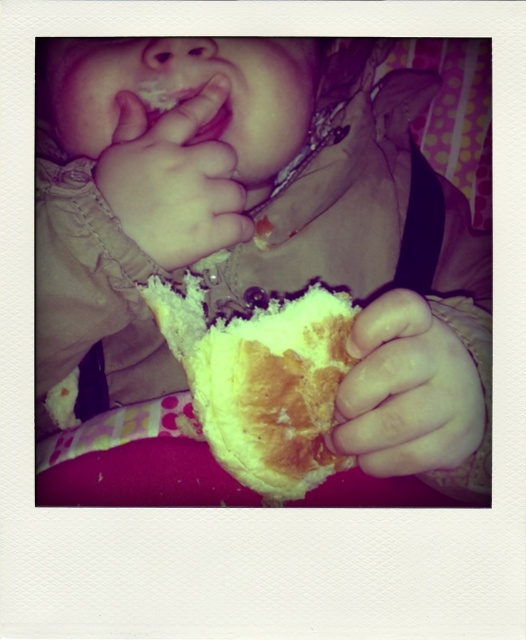
Question: Is golden crusty bread at lower center below smooth white bread at lower right?

Choices:
 (A) yes
 (B) no

Answer: (B)

Question: Is smooth white bread at lower right to the right of smooth beige hand at upper left from the viewer's perspective?

Choices:
 (A) no
 (B) yes

Answer: (B)

Question: Does soft white bread at center have a larger size compared to smooth beige hand at upper left?

Choices:
 (A) no
 (B) yes

Answer: (B)

Question: Which point is farther to the camera?

Choices:
 (A) (313, 376)
 (B) (37, 436)

Answer: (B)

Question: Which object is farther from the camera taking this photo?

Choices:
 (A) soft white bread at center
 (B) smooth white bread at lower right

Answer: (A)

Question: Which is nearer to the smooth beige hand at upper left?

Choices:
 (A) golden crusty bread at lower center
 (B) smooth white bread at lower right
 (C) soft white bread at center

Answer: (A)